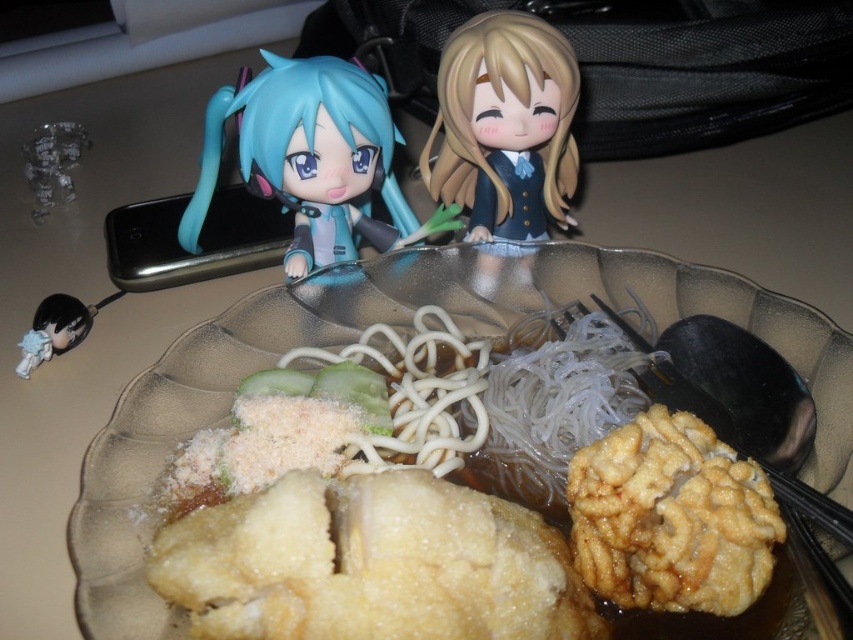
Question: Does translucent glass bowl at center appear under matte blue vinyl doll at upper left?

Choices:
 (A) no
 (B) yes

Answer: (B)

Question: Can you confirm if matte blue vinyl doll at upper left is positioned to the left of blonde hair doll at upper center?

Choices:
 (A) no
 (B) yes

Answer: (B)

Question: Considering the real-world distances, which object is farthest from the matte blue vinyl doll at upper left?

Choices:
 (A) translucent glass bowl at center
 (B) golden crispy fried chicken at center

Answer: (B)

Question: Which point is closer to the camera taking this photo?

Choices:
 (A) (248, 136)
 (B) (720, 552)

Answer: (B)

Question: Considering the relative positions of golden crispy fried chicken at center and matte blue vinyl doll at upper left in the image provided, where is golden crispy fried chicken at center located with respect to matte blue vinyl doll at upper left?

Choices:
 (A) below
 (B) above

Answer: (A)

Question: Among these points, which one is farthest from the camera?

Choices:
 (A) (390, 362)
 (B) (485, 136)
 (C) (115, 556)

Answer: (B)